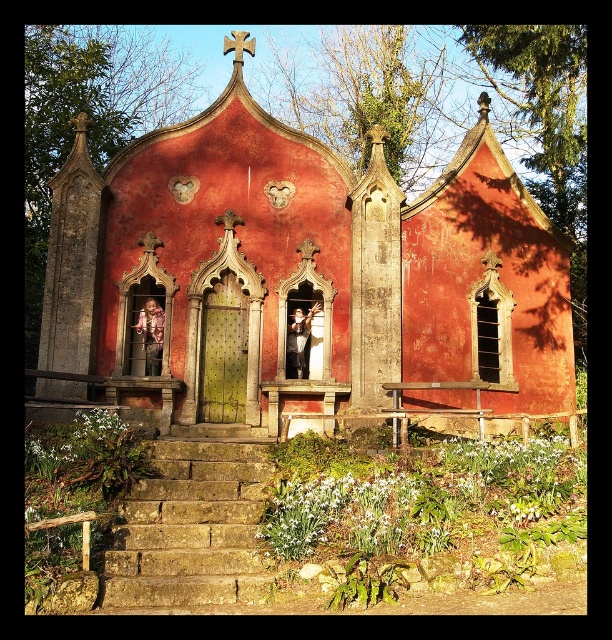
Does rustic stone chapel at center have a larger size compared to smooth white dress at center?

Indeed, rustic stone chapel at center has a larger size compared to smooth white dress at center.

What do you see at coordinates (300, 278) in the screenshot? The height and width of the screenshot is (640, 612). I see `rustic stone chapel at center` at bounding box center [300, 278].

Where is `rustic stone chapel at center`? rustic stone chapel at center is located at coordinates (300, 278).

Which is more to the right, floral-patterned sweater at center or smooth wooden cross at upper center?

smooth wooden cross at upper center

Is point (143, 312) in front of point (225, 36)?

Yes, it is.

Which is behind, point (138, 324) or point (231, 44)?

The point (231, 44) is more distant.

What are the coordinates of `floral-patterned sweater at center` in the screenshot? It's located at (151, 333).

Between rustic stone chapel at center and floral-patterned sweater at center, which one has less height?

With less height is floral-patterned sweater at center.

The image size is (612, 640). I want to click on rustic stone chapel at center, so click(300, 278).

Locate an element on the screen. rustic stone chapel at center is located at coordinates (300, 278).

At what (x,y) coordinates should I click in order to perform the action: click on rustic stone chapel at center. Please return your answer as a coordinate pair (x, y). Looking at the image, I should click on 300,278.